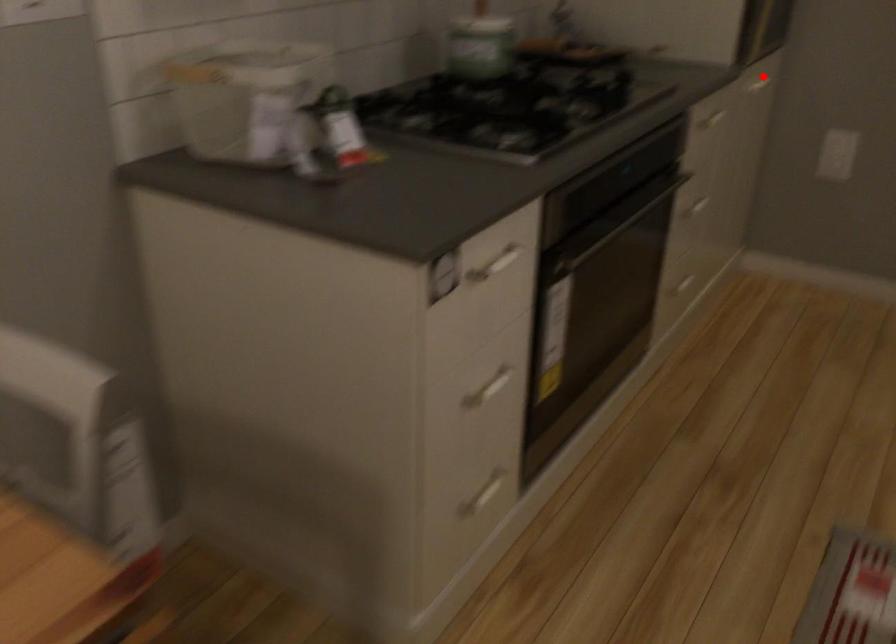
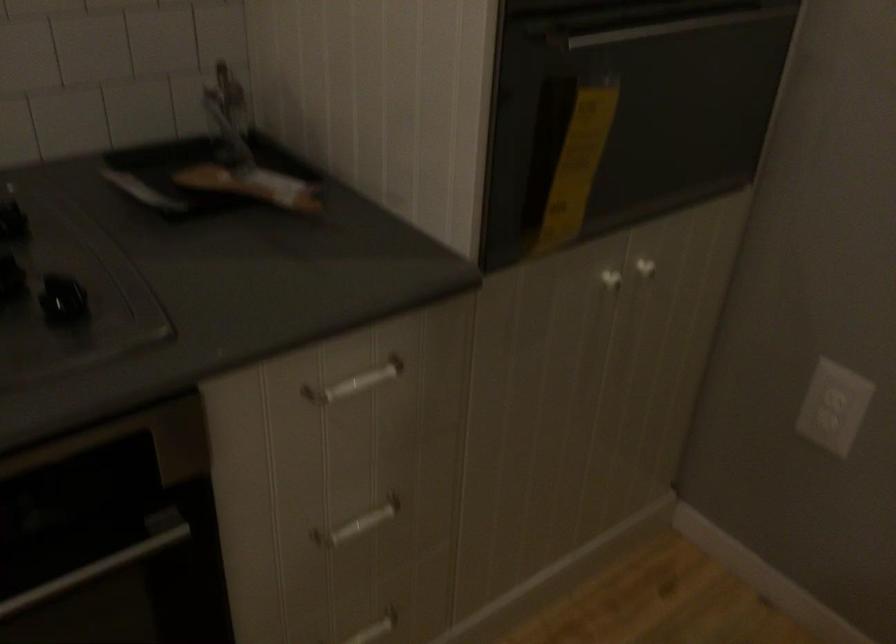
Question: I am providing you with two images of the same scene from different viewpoints. A red point is shown in image1. For the corresponding object point in image2, is it positioned nearer or farther from the camera?

Choices:
 (A) Nearer
 (B) Farther

Answer: (A)